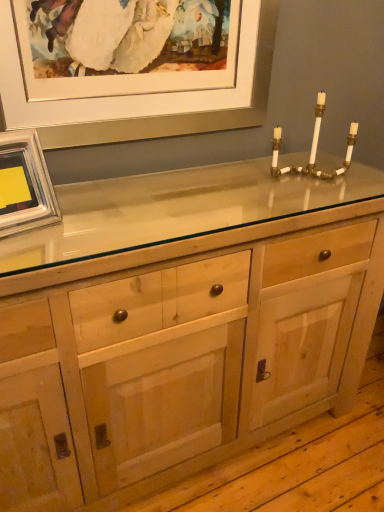
Where is `vacant region below white ceramic candle holder at upper right (from a real-world perspective)`? This screenshot has width=384, height=512. vacant region below white ceramic candle holder at upper right (from a real-world perspective) is located at coordinates (301, 179).